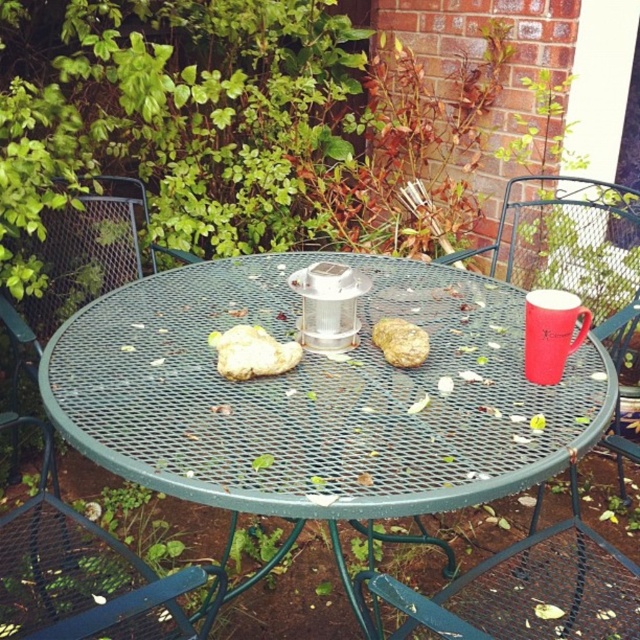
You are a guest at a patio gathering and want to grab the brown crumbly bread at center from your current position near the green metal chair at lower left. Can you reach it without moving your chair?

The green metal chair at lower left is positioned on the left side of brown crumbly bread at center, so you can reach it without moving your chair.

You are a guest at a patio party and notice the metal mesh chair at right and the white crumbly bread at center. If you want to sit on the chair, will the bread be crushed?

The metal mesh chair at right is positioned over white crumbly bread at center, so sitting on the chair will likely crush the bread.

You are a small cat that wants to jump onto the table. You see the green metal chair at lower left and the brown crumbly bread at center. Which object is taller and could help you as a step?

The green metal chair at lower left is much taller than the brown crumbly bread at center, so it could serve as a step to help you jump onto the table.